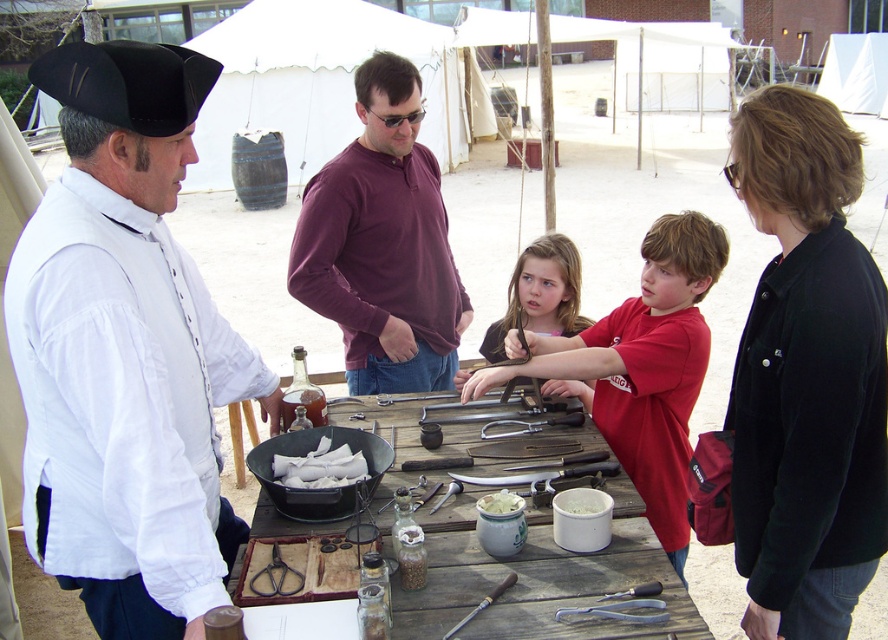
Which of these two, wooden table at center or white paper napkins at center, stands taller?

wooden table at center

Does wooden table at center have a greater height compared to white paper napkins at center?

Correct, wooden table at center is much taller as white paper napkins at center.

Between point (409, 604) and point (341, 467), which one is positioned behind?

The point (341, 467) is behind.

Locate an element on the screen. The height and width of the screenshot is (640, 888). wooden table at center is located at coordinates (538, 576).

Consider the image. Is black cotton jacket at upper right above white matte bowl at center?

Yes, black cotton jacket at upper right is above white matte bowl at center.

Does point (875, 492) come farther from viewer compared to point (592, 497)?

That is False.

The image size is (888, 640). Find the location of `black cotton jacket at upper right`. black cotton jacket at upper right is located at coordinates (806, 376).

Which of these two, black cotton jacket at upper right or wooden table at center, stands taller?

black cotton jacket at upper right

Measure the distance between point (779,316) and camera.

6.08 feet

This screenshot has width=888, height=640. Find the location of `black cotton jacket at upper right`. black cotton jacket at upper right is located at coordinates (806, 376).